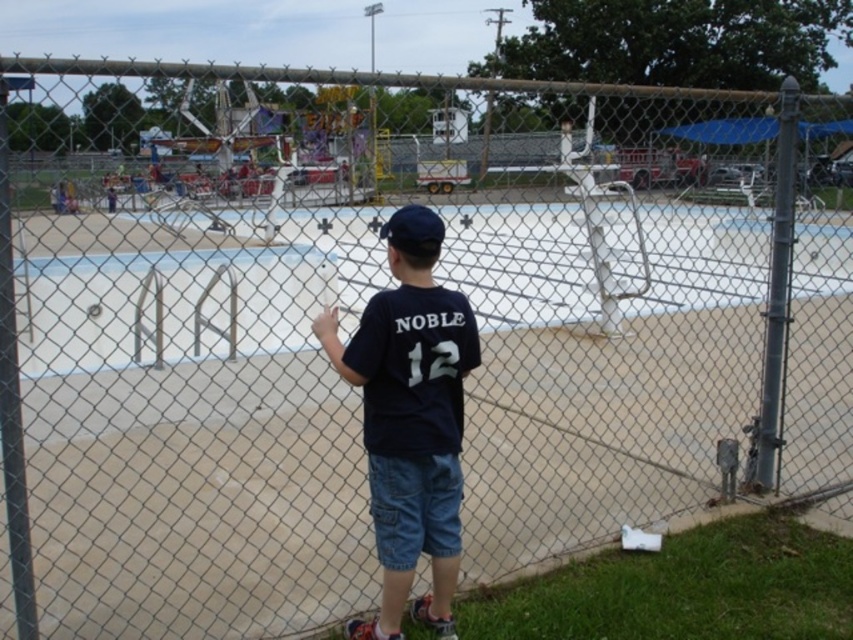
Question: Which point is farther to the camera?

Choices:
 (A) black fabric baseball cap at center
 (B) dark blue t-shirt at center

Answer: (A)

Question: Does dark blue t-shirt at center come behind black fabric baseball cap at center?

Choices:
 (A) no
 (B) yes

Answer: (A)

Question: From the image, what is the correct spatial relationship of dark blue t-shirt at center in relation to black fabric baseball cap at center?

Choices:
 (A) right
 (B) left

Answer: (B)

Question: Among these objects, which one is nearest to the camera?

Choices:
 (A) dark blue t-shirt at center
 (B) black fabric baseball cap at center

Answer: (A)

Question: Which point is farther to the camera?

Choices:
 (A) (392, 579)
 (B) (412, 248)

Answer: (A)

Question: Does dark blue t-shirt at center have a greater width compared to black fabric baseball cap at center?

Choices:
 (A) no
 (B) yes

Answer: (B)